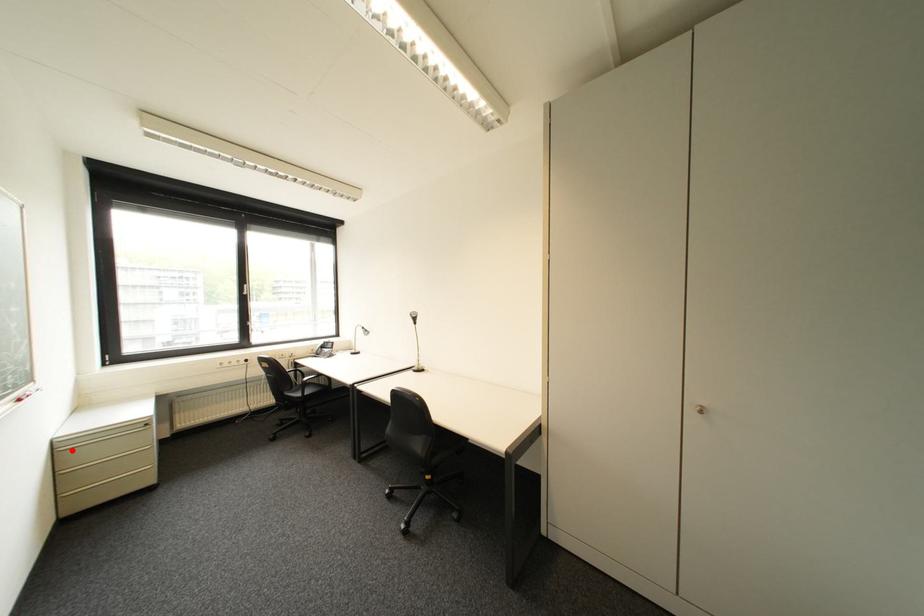
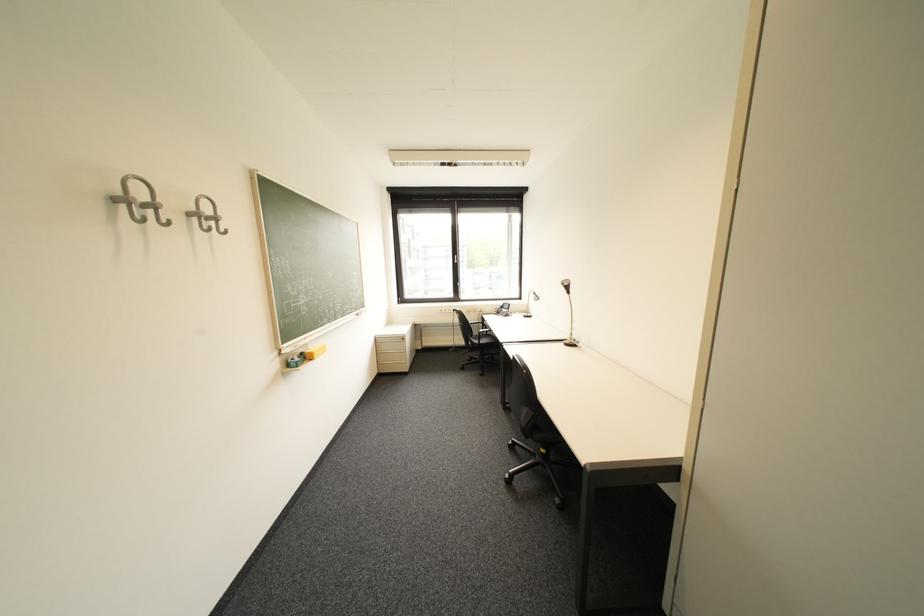
Question: I am providing you with two images of the same scene from different viewpoints. Given a red point in image1, look at the same physical point in image2. Is it:

Choices:
 (A) Closer to the viewpoint
 (B) Farther from the viewpoint

Answer: (A)